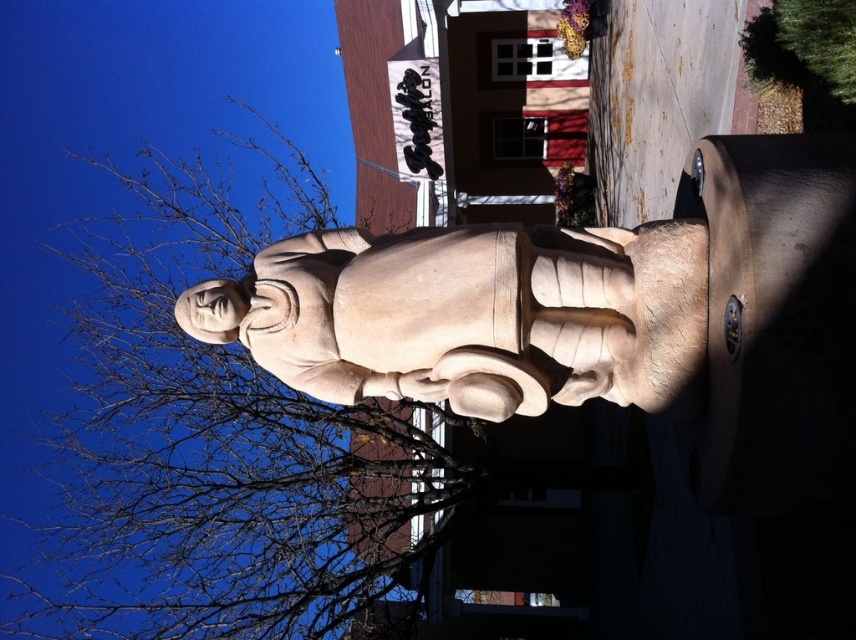
Question: Which point is closer to the camera?

Choices:
 (A) (509, 289)
 (B) (135, 449)

Answer: (A)

Question: Does bare branches at upper left appear over smooth beige statue at center?

Choices:
 (A) no
 (B) yes

Answer: (A)

Question: Can you confirm if bare branches at upper left is thinner than smooth beige statue at center?

Choices:
 (A) yes
 (B) no

Answer: (B)

Question: Is bare branches at upper left to the left of smooth beige statue at center from the viewer's perspective?

Choices:
 (A) no
 (B) yes

Answer: (B)